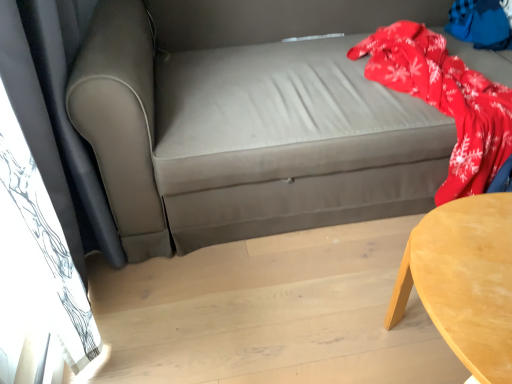
Question: From their relative heights in the image, would you say red fleece blanket at upper right is taller or shorter than red fleece blanket at upper right?

Choices:
 (A) tall
 (B) short

Answer: (A)

Question: Considering the positions of point (474, 114) and point (453, 23), is point (474, 114) closer or farther from the camera than point (453, 23)?

Choices:
 (A) closer
 (B) farther

Answer: (A)

Question: Based on their relative distances, which object is farther from the light wood table at lower right?

Choices:
 (A) red fleece blanket at upper right
 (B) red fleece blanket at upper right
 (C) matte gray couch at center

Answer: (A)

Question: Based on their relative distances, which object is farther from the red fleece blanket at upper right?

Choices:
 (A) light wood table at lower right
 (B) matte gray couch at center
 (C) red fleece blanket at upper right

Answer: (A)